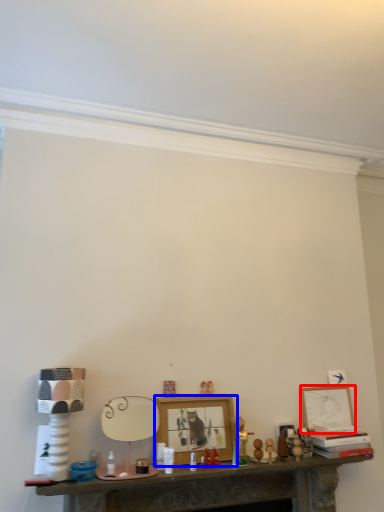
Question: Which of the following is the farthest to the observer, picture frame (highlighted by a red box) or picture frame (highlighted by a blue box)?

Choices:
 (A) picture frame
 (B) picture frame

Answer: (A)